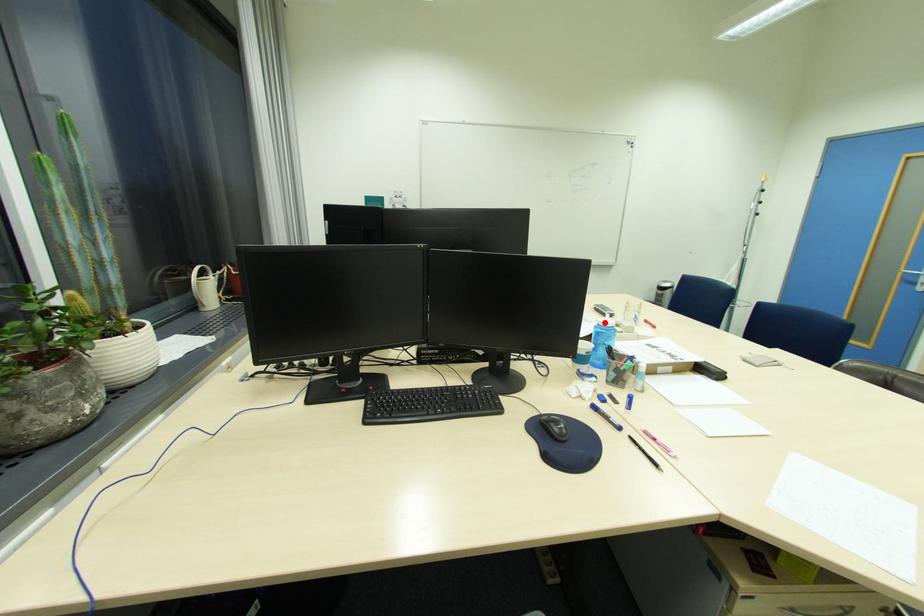
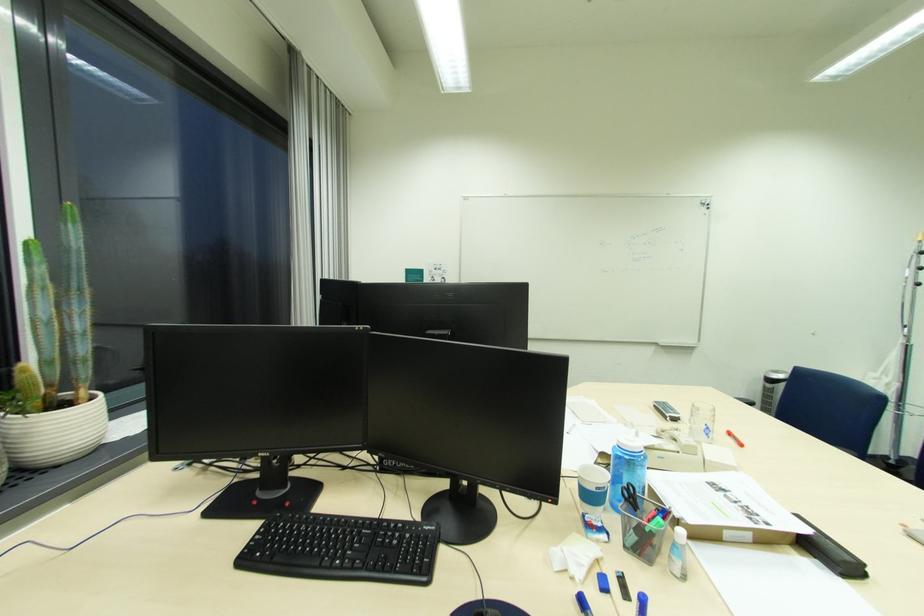
Locate, in the second image, the point that corresponds to the highlighted location in the first image.

(624, 442)